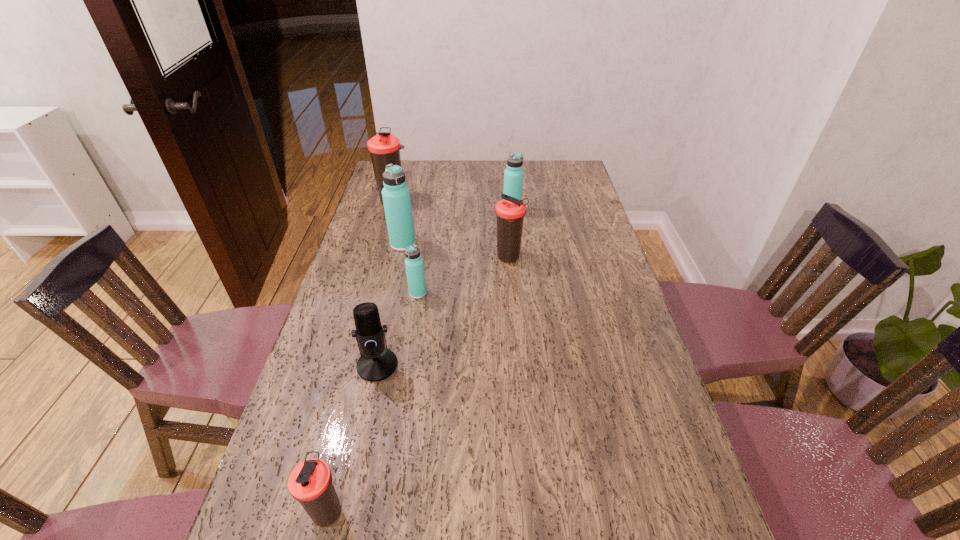
You are a GUI agent. You are given a task and a screenshot of the screen. Output one action in this format:
    pyautogui.click(x=<x>, y=<y>)
    Task: Click on the microphone located in the left edge section of the desktop
    
    Given the screenshot: What is the action you would take?
    pyautogui.click(x=376, y=363)

Identify the location of vacant space at the far edge of the desktop. (534, 168).

Identify the location of vacant position at the left edge of the desktop. (315, 354).

The image size is (960, 540). I want to click on vacant space at the right edge of the desktop, so click(625, 403).

This screenshot has height=540, width=960. I want to click on vacant space at the far left corner of the desktop, so click(408, 162).

The height and width of the screenshot is (540, 960). Identify the location of empty space that is in between the farthest brown thermos bottle and the farthest aqua thermos bottle. (453, 206).

Locate an element on the screen. The height and width of the screenshot is (540, 960). free space that is in between the rightmost brown thermos bottle and the leftmost aqua thermos bottle is located at coordinates (456, 251).

You are a GUI agent. You are given a task and a screenshot of the screen. Output one action in this format:
    pyautogui.click(x=<x>, y=<y>)
    Task: Click on the free spot between the rightmost aqua thermos bottle and the farthest brown thermos bottle
    The image size is (960, 540).
    Given the screenshot: What is the action you would take?
    [453, 206]

Image resolution: width=960 pixels, height=540 pixels. I want to click on empty location between the farthest aqua thermos bottle and the nearest aqua thermos bottle, so click(x=465, y=252).

Identify the location of vacant space in between the black microphone and the biggest brown thermos bottle. (386, 282).